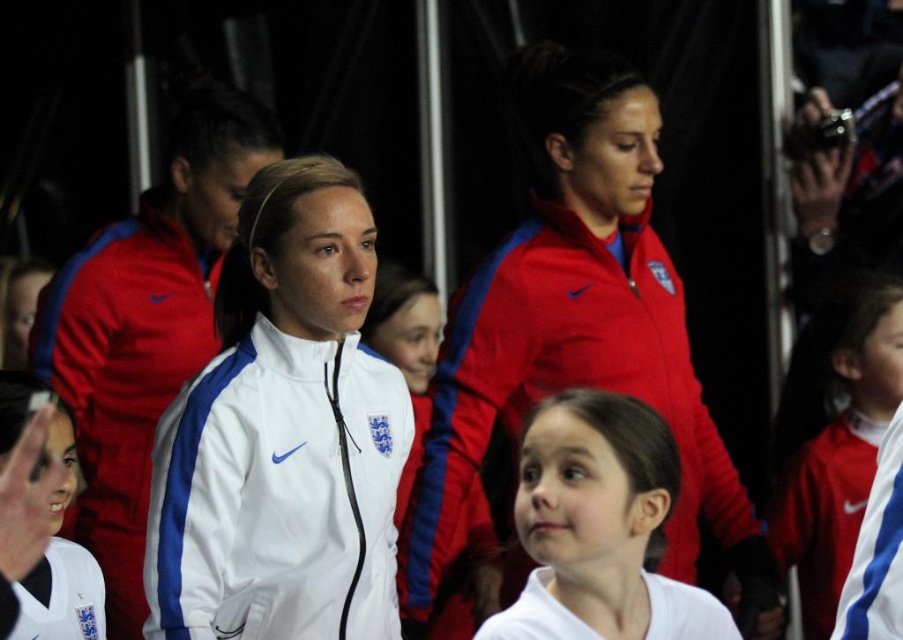
Can you confirm if matte red jacket at center is positioned to the right of white matte shirt at center?

Indeed, matte red jacket at center is positioned on the right side of white matte shirt at center.

Can you confirm if matte red jacket at center is bigger than white matte shirt at center?

Indeed, matte red jacket at center has a larger size compared to white matte shirt at center.

Which is in front, point (540, 285) or point (590, 476)?

Point (590, 476)

The image size is (903, 640). In order to click on matte red jacket at center in this screenshot , I will do (578, 326).

Who is more forward, (343,248) or (511,406)?

Point (343,248)

Is white matte jacket at center taller than matte red jacket at center?

No.

Is point (347, 476) less distant than point (628, 115)?

Yes.

Locate an element on the screen. white matte jacket at center is located at coordinates (284, 435).

Is white matte jacket at center taller than white matte shirt at center?

Yes.

Which is in front, point (234, 426) or point (699, 636)?

Point (699, 636) is in front.

Locate an element on the screen. white matte jacket at center is located at coordinates (284, 435).

Where is `white matte jacket at center`? This screenshot has height=640, width=903. white matte jacket at center is located at coordinates (284, 435).